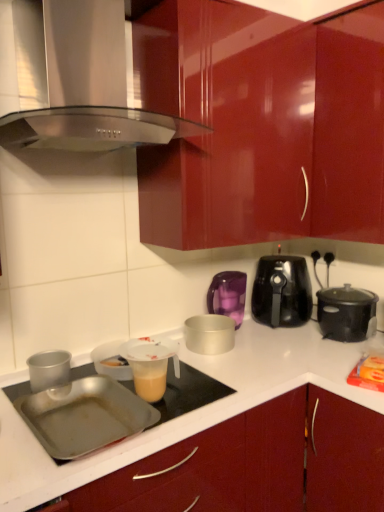
The width and height of the screenshot is (384, 512). In order to click on vacant area in front of black plastic air fryer at center right, which is the 4th kitchen appliance in left-to-right order in this screenshot , I will do `click(288, 344)`.